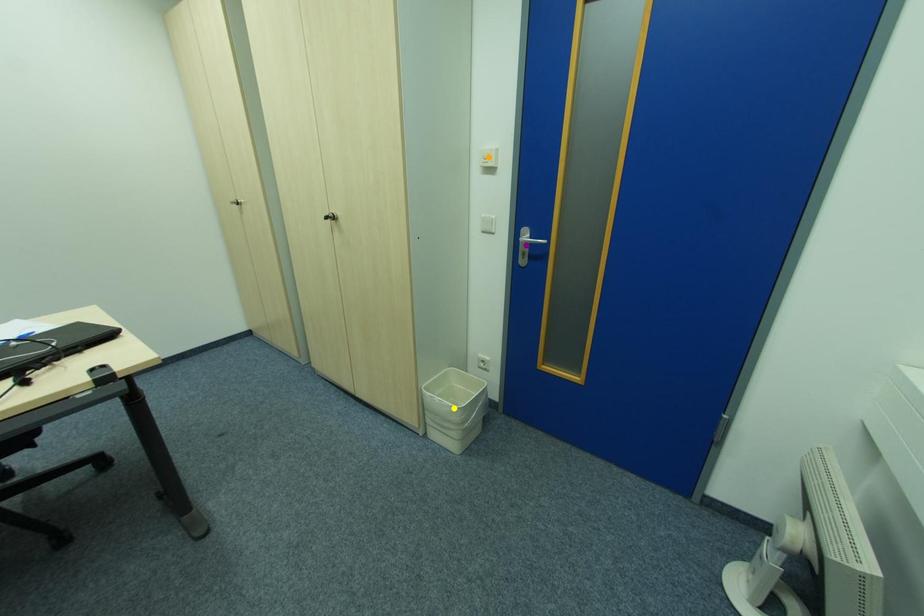
Order these from nearest to farthest:
orange point | purple point | yellow point

purple point → orange point → yellow point